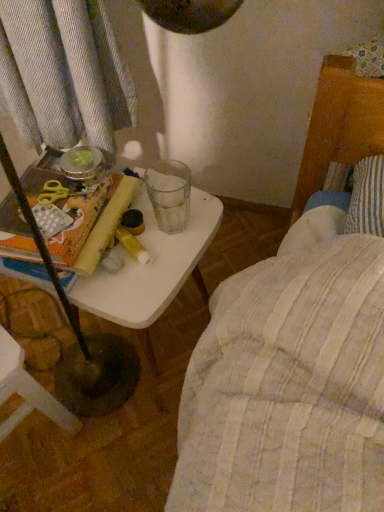
Describe the element at coordinates (152, 270) in the screenshot. I see `white plastic table at center` at that location.

Measure the distance between point (180, 273) and camera.

The distance of point (180, 273) from camera is 79.30 centimeters.

The image size is (384, 512). I want to click on white plastic table at center, so pyautogui.click(x=152, y=270).

In order to face white plastic table at center, should I rotate leftwards or rightwards?

Rotate left and turn 6.736 degrees.

Find the location of a particular element. This screenshot has width=384, height=512. white plastic table at center is located at coordinates (152, 270).